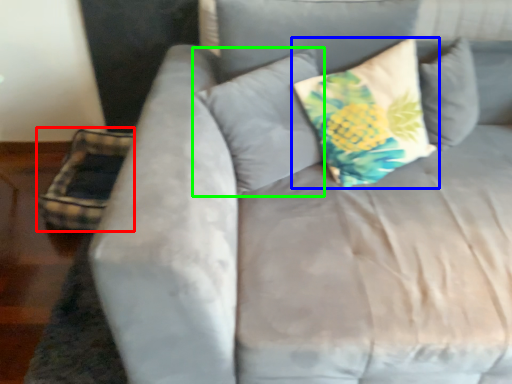
Question: Which is nearer to the pillow (highlighted by a red box)? pillow (highlighted by a blue box) or pillow (highlighted by a green box).

Choices:
 (A) pillow
 (B) pillow

Answer: (B)